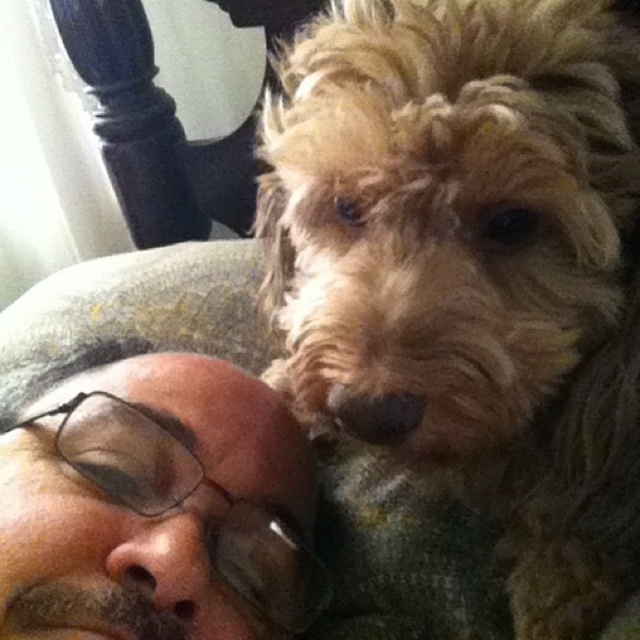
You are a photographer trying to capture the perfect shot. You notice the fuzzy golden fur at center and the brown matte glasses at upper left. Which object should you focus on first if you want to capture the one that is positioned to the right?

The fuzzy golden fur at center is to the right of the brown matte glasses at upper left, so you should focus on the fuzzy golden fur at center first.

You are an interior designer analyzing the image. You need to locate the fuzzy golden fur at center in the image. What are its coordinates?

The fuzzy golden fur at center is located at coordinates point (470, 266).

From the picture: You are a photographer trying to capture a candid shot of the person and their dog. You notice the fuzzy golden fur at center and the brown matte glasses at upper left in your viewfinder. Which object should you focus on first to ensure both are in sharp focus?

The fuzzy golden fur at center is closer to the viewer than the brown matte glasses at upper left, so you should focus on the fuzzy golden fur at center first to ensure both are in sharp focus.